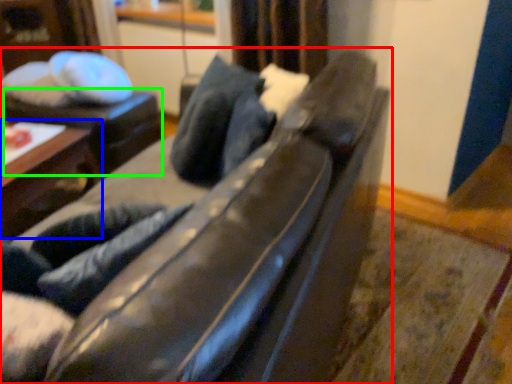
Question: Estimate the real-world distances between objects in this image. Which object is closer to studio couch (highlighted by a red box), table (highlighted by a blue box) or table (highlighted by a green box)?

Choices:
 (A) table
 (B) table

Answer: (A)